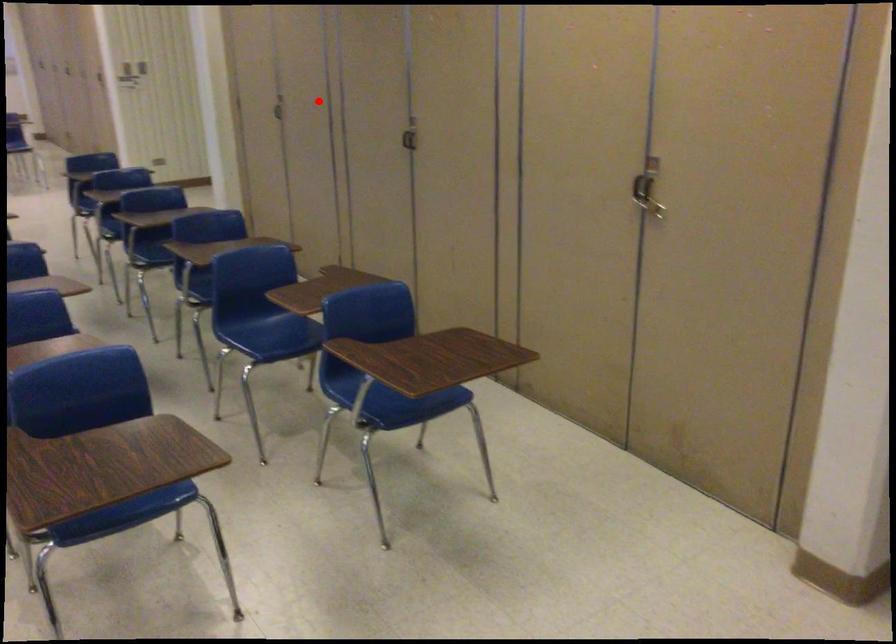
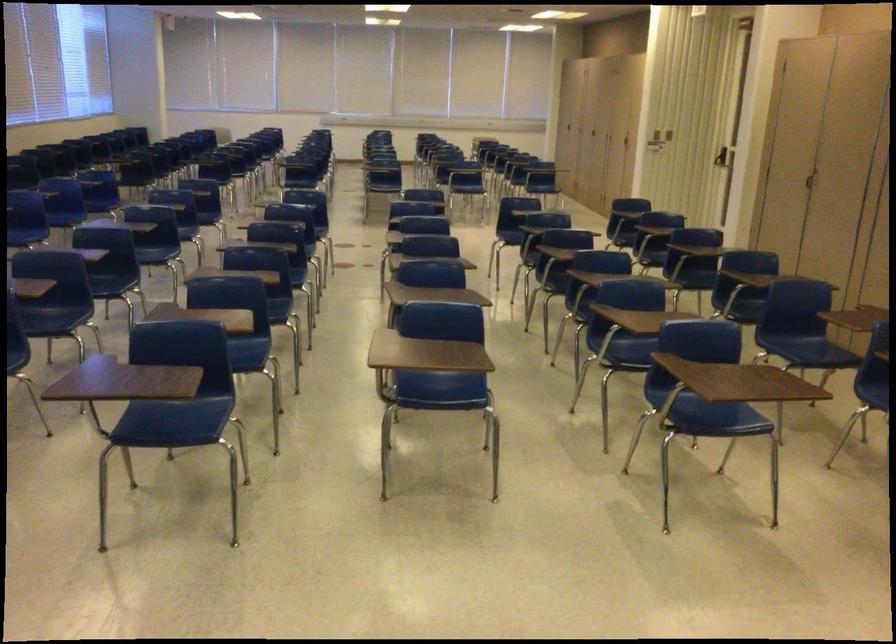
Question: I am providing you with two images of the same scene from different viewpoints. A red point is shown in image1. For the corresponding object point in image2, is it positioned nearer or farther from the camera?

Choices:
 (A) Nearer
 (B) Farther

Answer: (B)